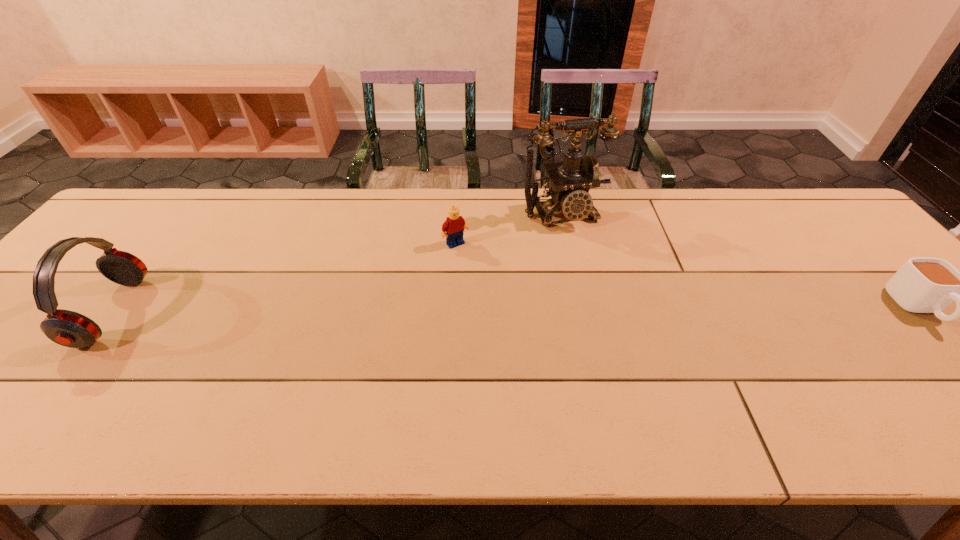
Locate an element on the screen. The width and height of the screenshot is (960, 540). free spot on the desktop that is between the leftmost object and the rightmost object and is positioned on the front-facing side of the third object from right to left is located at coordinates (509, 310).

Find the location of a particular element. This screenshot has height=540, width=960. free spot on the desktop that is between the second tallest object and the shortest object and is positioned on the rotary dial of the tallest object is located at coordinates (612, 309).